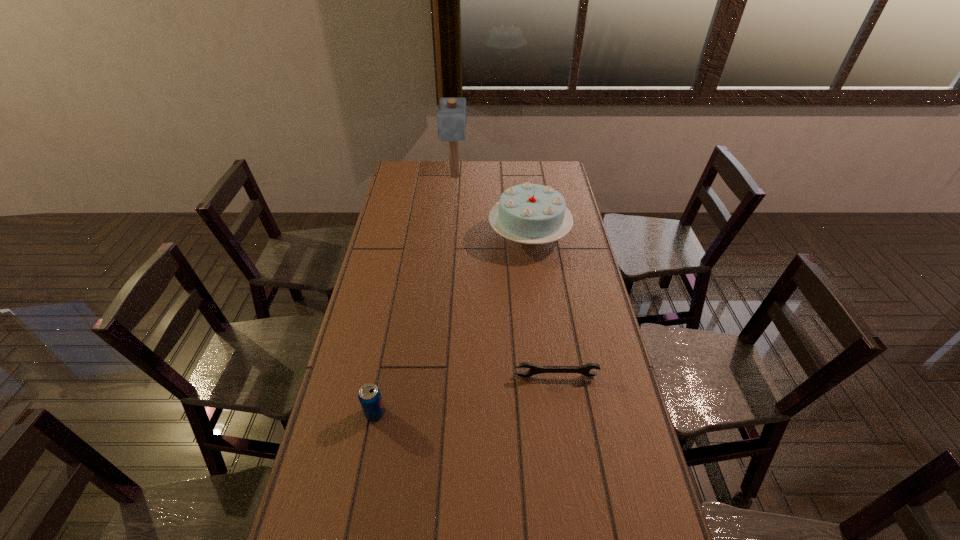
Locate an element on the screen. Image resolution: width=960 pixels, height=540 pixels. free space between the fourth farthest object and the right wrench is located at coordinates (466, 395).

The height and width of the screenshot is (540, 960). In order to click on vacant area that lies between the third object from right to left and the pop soda in this screenshot , I will do `click(415, 295)`.

Image resolution: width=960 pixels, height=540 pixels. In order to click on empty location between the birthday cake and the farthest object in this screenshot , I will do `click(492, 206)`.

Find the location of a particular element. The width and height of the screenshot is (960, 540). free space that is in between the tallest object and the second tallest object is located at coordinates (492, 206).

Where is `unoccupied position between the third tallest object and the mallet`? unoccupied position between the third tallest object and the mallet is located at coordinates (415, 295).

What are the coordinates of `empty space between the third shortest object and the farther wrench` in the screenshot? It's located at (466, 395).

Locate an element on the screen. object that can be found as the closest to the farther wrench is located at coordinates (369, 395).

Identify the location of object identified as the second closest to the third tallest object. This screenshot has height=540, width=960. (585, 369).

The height and width of the screenshot is (540, 960). I want to click on free region that satisfies the following two spatial constraints: 1. on the back side of the pop soda; 2. on the right side of the fourth nearest object, so click(409, 235).